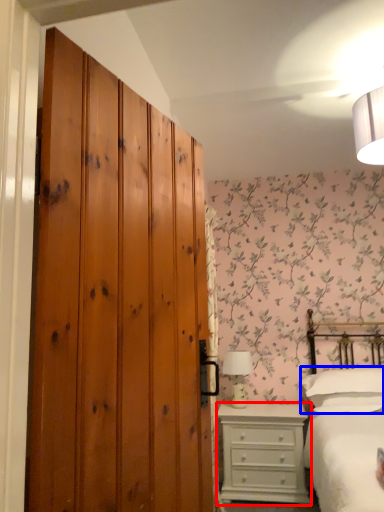
Question: Which of the following is the farthest to the observer, chest of drawers (highlighted by a red box) or pillow (highlighted by a blue box)?

Choices:
 (A) chest of drawers
 (B) pillow

Answer: (A)